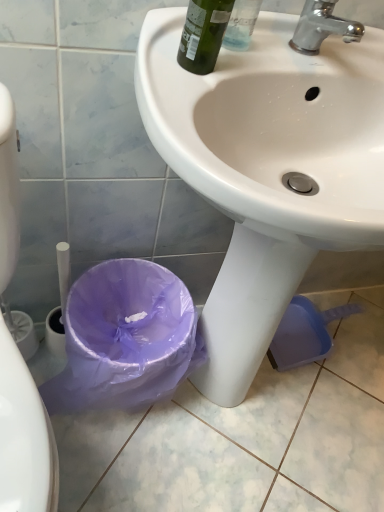
Question: In the image, is chrome metallic faucet at upper right positioned in front of or behind white glossy sink at center?

Choices:
 (A) behind
 (B) front

Answer: (A)

Question: Is chrome metallic faucet at upper right bigger or smaller than white glossy sink at center?

Choices:
 (A) big
 (B) small

Answer: (B)

Question: Which object is the farthest from the white glossy sink at center?

Choices:
 (A) green glass bottle at upper center
 (B) chrome metallic faucet at upper right
 (C) purple plastic bag at lower left

Answer: (B)

Question: Which is nearer to the white glossy sink at center?

Choices:
 (A) green glass bottle at upper center
 (B) purple plastic bag at lower left
 (C) chrome metallic faucet at upper right

Answer: (A)